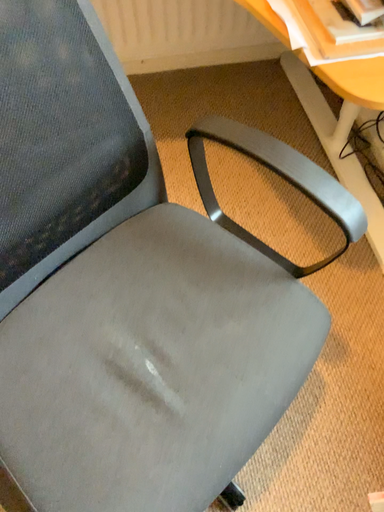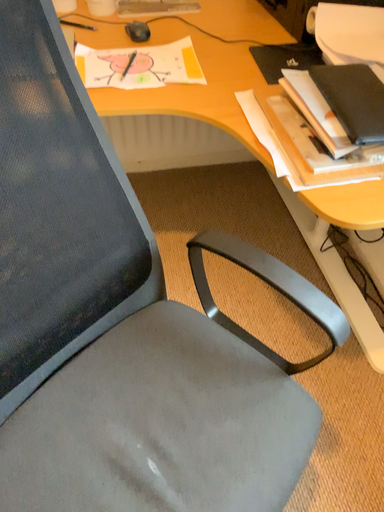
Question: Which way did the camera rotate in the video?

Choices:
 (A) rotated upward
 (B) rotated downward

Answer: (A)